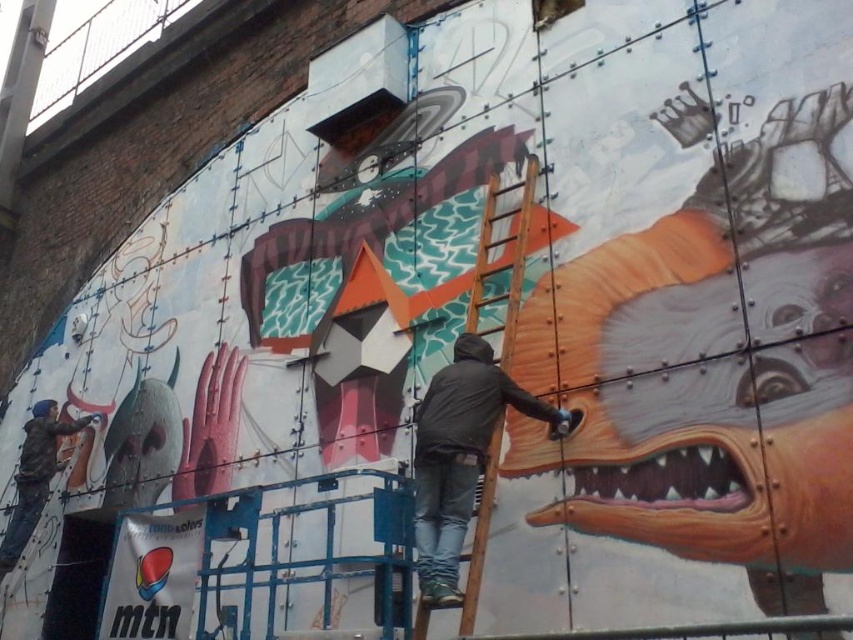
Is dark gray jacket at center in front of matte black jacket at left?

Yes, dark gray jacket at center is in front of matte black jacket at left.

You are a GUI agent. You are given a task and a screenshot of the screen. Output one action in this format:
    pyautogui.click(x=<x>, y=<y>)
    Task: Click on the dark gray jacket at center
    
    Given the screenshot: What is the action you would take?
    pyautogui.click(x=459, y=456)

Is point (550, 410) closer to viewer compared to point (9, 529)?

Yes.

Locate an element on the screen. This screenshot has width=853, height=640. dark gray jacket at center is located at coordinates (459, 456).

Is the position of wooden ladder at center less distant than that of matte black jacket at left?

Yes.

Locate an element on the screen. The image size is (853, 640). wooden ladder at center is located at coordinates (508, 260).

The image size is (853, 640). Find the location of `wooden ladder at center`. wooden ladder at center is located at coordinates (508, 260).

The image size is (853, 640). In order to click on wooden ladder at center in this screenshot , I will do `click(508, 260)`.

Is dark gray jacket at center above wooden ladder at center?

Actually, dark gray jacket at center is below wooden ladder at center.

Which is more to the right, dark gray jacket at center or wooden ladder at center?

dark gray jacket at center

Is point (439, 518) positioned after point (482, 230)?

No, (439, 518) is in front of (482, 230).

Locate an element on the screen. This screenshot has width=853, height=640. dark gray jacket at center is located at coordinates (459, 456).